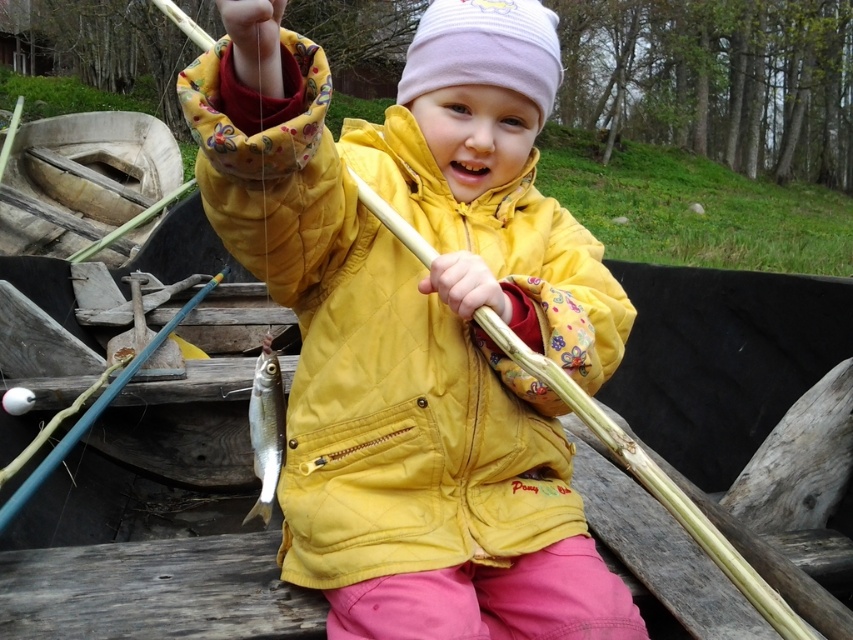
You are standing on the dock and see the yellow quilted jacket at center in the boat. If you want to throw a life preserver to the jacket, will it reach?

The yellow quilted jacket at center is 23.05 inches away from the viewer. Since the life preserver can travel that distance, it will reach the jacket.

You are a photographer trying to capture the child and the fish in the boat. Since you want both the yellow quilted jacket at center and the shiny silver fish at center in the frame, which object should you focus on first to ensure both are in the shot?

The yellow quilted jacket at center is positioned on the right side of the shiny silver fish at center, so focusing on the shiny silver fish at center first would allow you to frame both objects together since they are closely positioned.